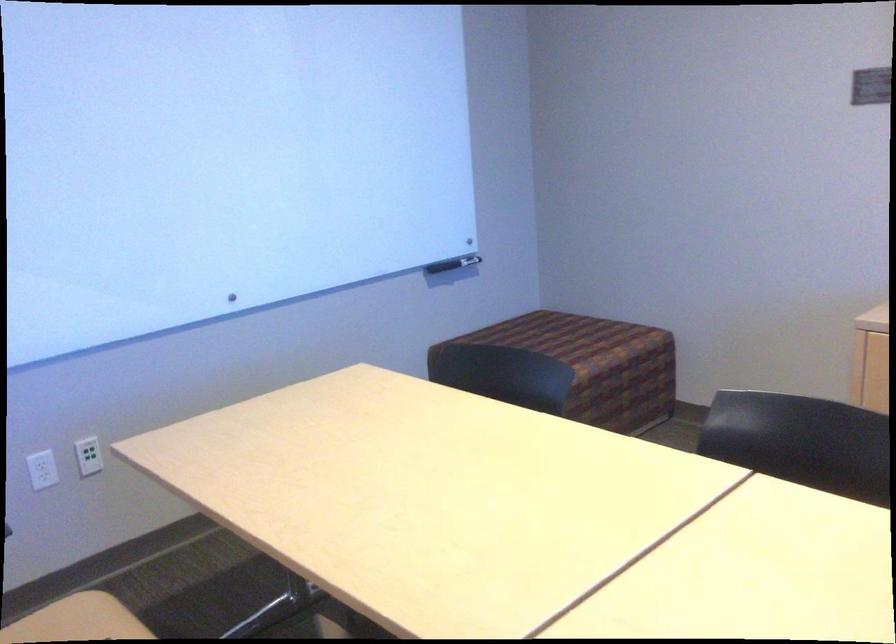
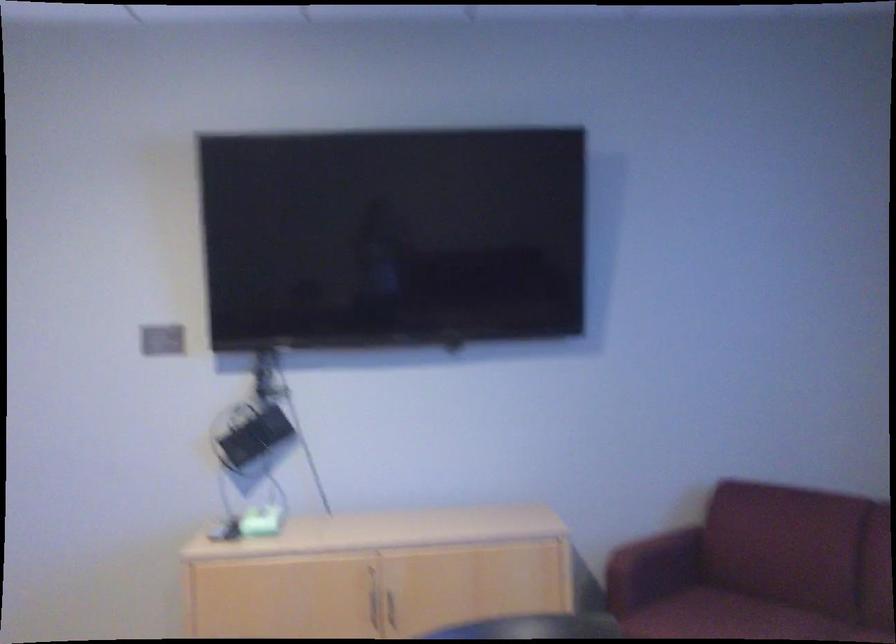
Question: The first image is from the beginning of the video and the second image is from the end. How did the camera likely rotate when shooting the video?

Choices:
 (A) Left
 (B) Right
 (C) Up
 (D) Down

Answer: (B)